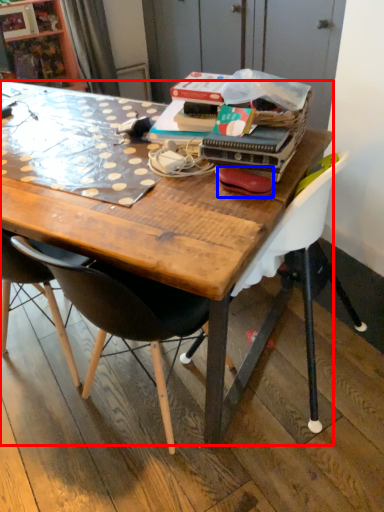
Question: Among these objects, which one is farthest to the camera, desk (highlighted by a red box) or handbag (highlighted by a blue box)?

Choices:
 (A) desk
 (B) handbag

Answer: (B)